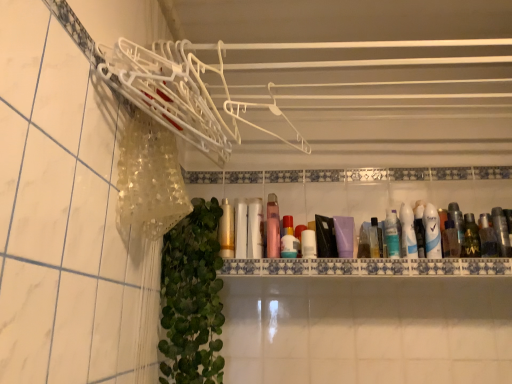
Question: Does gold metallic mouthwash at center, marked as the 11th mouthwash in a right-to-left arrangement, have a lesser height compared to green matte bottle at right, which is the third mouthwash in right-to-left order?

Choices:
 (A) yes
 (B) no

Answer: (B)

Question: Does gold metallic mouthwash at center, marked as the 11th mouthwash in a right-to-left arrangement, lie behind green matte bottle at right, which is the third mouthwash in right-to-left order?

Choices:
 (A) no
 (B) yes

Answer: (A)

Question: Is gold metallic mouthwash at center, the first mouthwash when ordered from left to right, at the right side of green matte bottle at right, which is the 9th mouthwash in left-to-right order?

Choices:
 (A) no
 (B) yes

Answer: (A)

Question: Does gold metallic mouthwash at center, marked as the 11th mouthwash in a right-to-left arrangement, appear on the left side of green matte bottle at right, which is the 9th mouthwash in left-to-right order?

Choices:
 (A) no
 (B) yes

Answer: (B)

Question: From the image's perspective, is gold metallic mouthwash at center, marked as the 11th mouthwash in a right-to-left arrangement, above green matte bottle at right, which is the third mouthwash in right-to-left order?

Choices:
 (A) yes
 (B) no

Answer: (A)

Question: From the image's perspective, is translucent plastic mouthwash at right, which is counted as the 11th mouthwash, starting from the left, located above or below white glossy tube at center, which is the first toiletry in left-to-right order?

Choices:
 (A) below
 (B) above

Answer: (B)

Question: Considering the positions of translucent plastic mouthwash at right, which is counted as the 11th mouthwash, starting from the left, and white glossy tube at center, which is the first toiletry in left-to-right order, in the image, is translucent plastic mouthwash at right, which is counted as the 11th mouthwash, starting from the left, bigger or smaller than white glossy tube at center, which is the first toiletry in left-to-right order,?

Choices:
 (A) big
 (B) small

Answer: (A)

Question: Is translucent plastic mouthwash at right, which is counted as the first mouthwash, starting from the right, to the left or to the right of white glossy tube at center, the second toiletry from the right, in the image?

Choices:
 (A) right
 (B) left

Answer: (A)

Question: In the image, is translucent plastic mouthwash at right, which is counted as the first mouthwash, starting from the right, positioned in front of or behind white glossy tube at center, the second toiletry from the right?

Choices:
 (A) behind
 (B) front

Answer: (A)

Question: Looking at the image, does white matte tube at center, the third mouthwash when ordered from left to right, seem bigger or smaller compared to green leafy plant at lower left?

Choices:
 (A) big
 (B) small

Answer: (B)

Question: From the image's perspective, is white matte tube at center, the third mouthwash when ordered from left to right, located above or below green leafy plant at lower left?

Choices:
 (A) above
 (B) below

Answer: (A)

Question: From a real-world perspective, is white matte tube at center, the 9th mouthwash positioned from the right, physically located above or below green leafy plant at lower left?

Choices:
 (A) below
 (B) above

Answer: (B)

Question: Is white matte tube at center, the 9th mouthwash positioned from the right, situated inside green leafy plant at lower left or outside?

Choices:
 (A) inside
 (B) outside

Answer: (B)

Question: Would you say white glossy tube at right, which is counted as the 7th mouthwash, starting from the left, is inside or outside gold metallic mouthwash at center, marked as the 11th mouthwash in a right-to-left arrangement?

Choices:
 (A) outside
 (B) inside

Answer: (A)

Question: Is white glossy tube at right, which is counted as the 7th mouthwash, starting from the left, taller or shorter than gold metallic mouthwash at center, marked as the 11th mouthwash in a right-to-left arrangement?

Choices:
 (A) short
 (B) tall

Answer: (A)